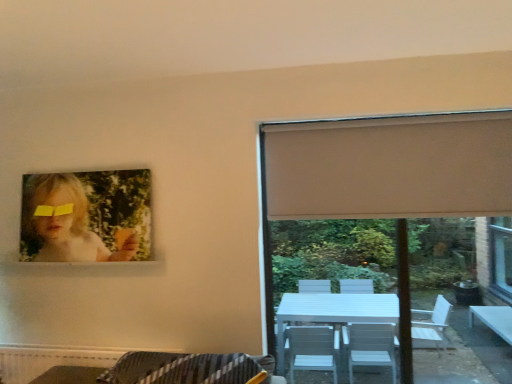
Question: Based on their positions, is matte paper portrait at upper left located to the left or right of white matte window at upper right?

Choices:
 (A) right
 (B) left

Answer: (B)

Question: Considering their positions, is matte paper portrait at upper left located in front of or behind white matte window at upper right?

Choices:
 (A) behind
 (B) front

Answer: (A)

Question: Which is nearer to the beige fabric curtain at right?

Choices:
 (A) matte paper portrait at upper left
 (B) white matte window at upper right
 (C) yellow matte glasses at upper left

Answer: (B)

Question: Which object is positioned farthest from the beige fabric curtain at right?

Choices:
 (A) yellow matte glasses at upper left
 (B) white matte window at upper right
 (C) matte paper portrait at upper left

Answer: (A)